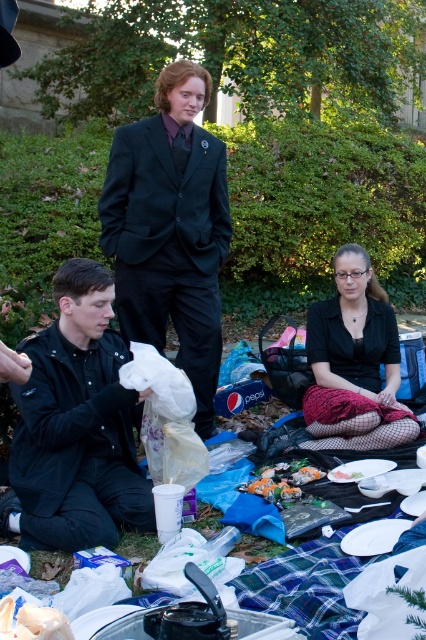
Question: Can you confirm if black textured skirt at center is positioned above shiny plastic bag at lower center?

Choices:
 (A) yes
 (B) no

Answer: (A)

Question: Which object is the farthest from the black matte jacket at lower left?

Choices:
 (A) black matte suit at center
 (B) black textured skirt at center

Answer: (B)

Question: Which of the following is the closest to the observer?

Choices:
 (A) [x=340, y=300]
 (B) [x=120, y=472]

Answer: (B)

Question: Considering the relative positions of black matte jacket at lower left and shiny plastic bag at lower center in the image provided, where is black matte jacket at lower left located with respect to shiny plastic bag at lower center?

Choices:
 (A) above
 (B) below

Answer: (A)

Question: Which point is farther to the camera?

Choices:
 (A) black matte jacket at lower left
 (B) black textured skirt at center
 (C) shiny plastic bag at lower center

Answer: (B)

Question: Is black matte jacket at lower left bigger than black matte suit at center?

Choices:
 (A) yes
 (B) no

Answer: (A)